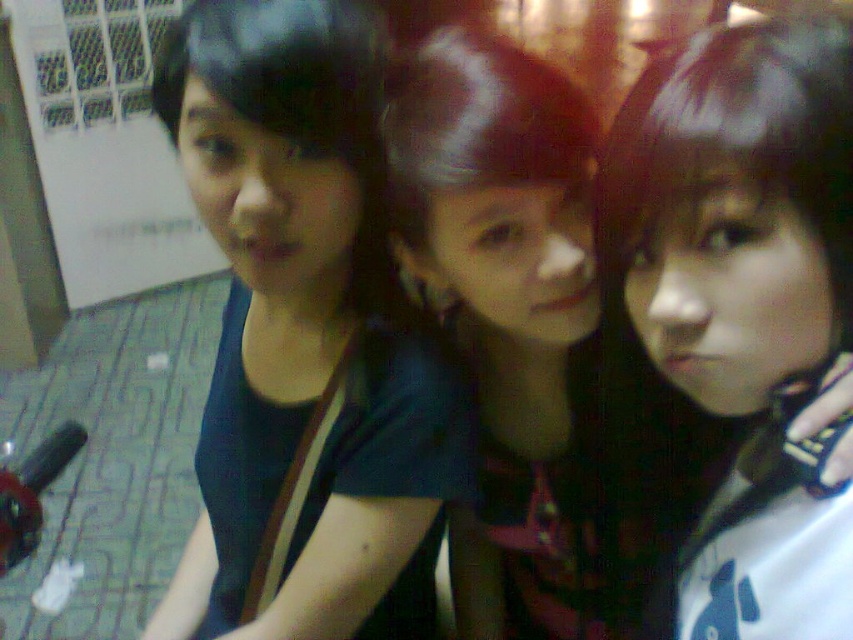
Question: Is matte black hair at center positioned at the back of matte black shirt at center?

Choices:
 (A) no
 (B) yes

Answer: (A)

Question: Is matte black hair at center above matte black shirt at center?

Choices:
 (A) yes
 (B) no

Answer: (A)

Question: Is matte black hair at center positioned behind matte black shirt at center?

Choices:
 (A) no
 (B) yes

Answer: (A)

Question: Among these points, which one is nearest to the camera?

Choices:
 (A) (556, 88)
 (B) (813, 92)

Answer: (B)

Question: Which point is closer to the camera?

Choices:
 (A) (761, 96)
 (B) (572, 388)

Answer: (A)